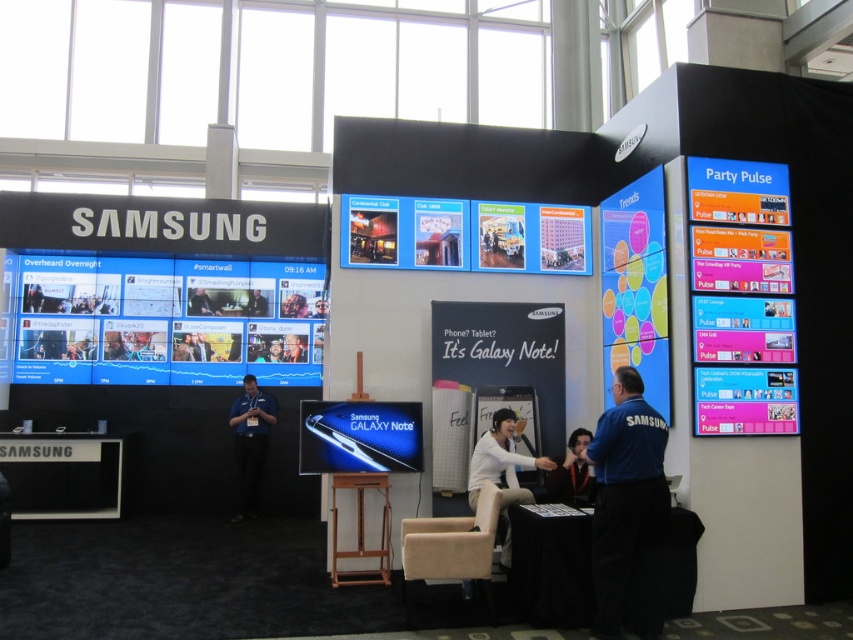
Question: Which object is farther from the camera taking this photo?

Choices:
 (A) wooden stool at center
 (B) dark blue fabric shirt at center

Answer: (A)

Question: Estimate the real-world distances between objects in this image. Which object is closer to the wooden stool at center?

Choices:
 (A) white fabric chair at center
 (B) blue fabric shirt at center

Answer: (A)

Question: Can you confirm if blue fabric shirt at center is thinner than dark blue fabric shirt at center?

Choices:
 (A) yes
 (B) no

Answer: (B)

Question: Which object is the closest to the dark blue fabric shirt at center?

Choices:
 (A) blue fabric shirt at right
 (B) white fabric chair at center
 (C) wooden stool at center
 (D) blue fabric shirt at center

Answer: (B)

Question: Does white fabric chair at center have a greater width compared to dark blue fabric shirt at center?

Choices:
 (A) no
 (B) yes

Answer: (B)

Question: Can you confirm if blue fabric shirt at center is thinner than dark blue fabric shirt at center?

Choices:
 (A) no
 (B) yes

Answer: (A)